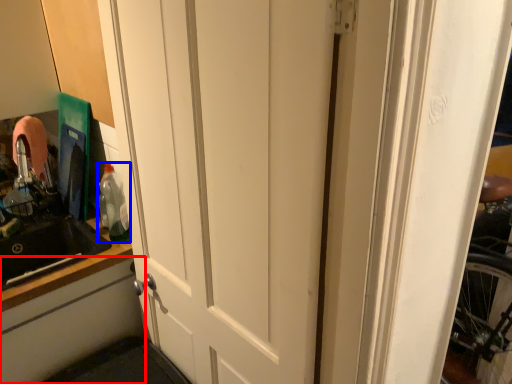
Question: Which point is closer to the camera, cabinetry (highlighted by a red box) or bottle (highlighted by a blue box)?

Choices:
 (A) cabinetry
 (B) bottle

Answer: (A)